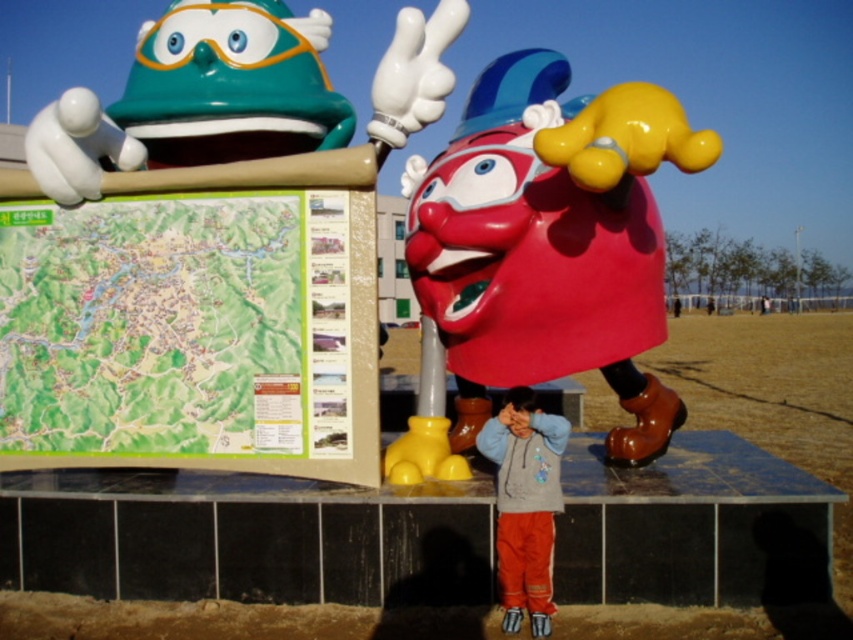
Question: Estimate the real-world distances between objects in this image. Which object is closer to the teal glossy helmet at upper left?

Choices:
 (A) shiny plastic helmet at upper left
 (B) shiny plastic clown at center

Answer: (A)

Question: Which object appears farthest from the camera in this image?

Choices:
 (A) teal glossy helmet at upper left
 (B) shiny plastic clown at center
 (C) green paper map at upper left
 (D) light blue fleece jacket at center

Answer: (C)

Question: Is green paper map at upper left to the right of teal glossy helmet at upper left from the viewer's perspective?

Choices:
 (A) yes
 (B) no

Answer: (A)

Question: Which point appears closest to the camera in this image?

Choices:
 (A) (166, 275)
 (B) (383, 112)
 (C) (103, 428)
 (D) (547, 417)

Answer: (D)

Question: Can you confirm if green paper map at upper left is thinner than light blue fleece jacket at center?

Choices:
 (A) no
 (B) yes

Answer: (A)

Question: Does green paper map at upper left appear over light blue fleece jacket at center?

Choices:
 (A) no
 (B) yes

Answer: (B)